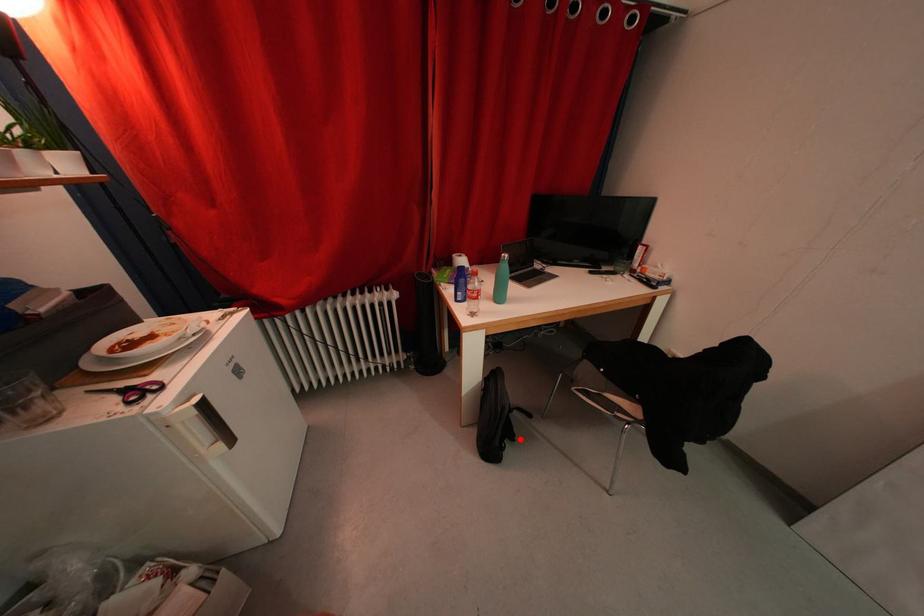
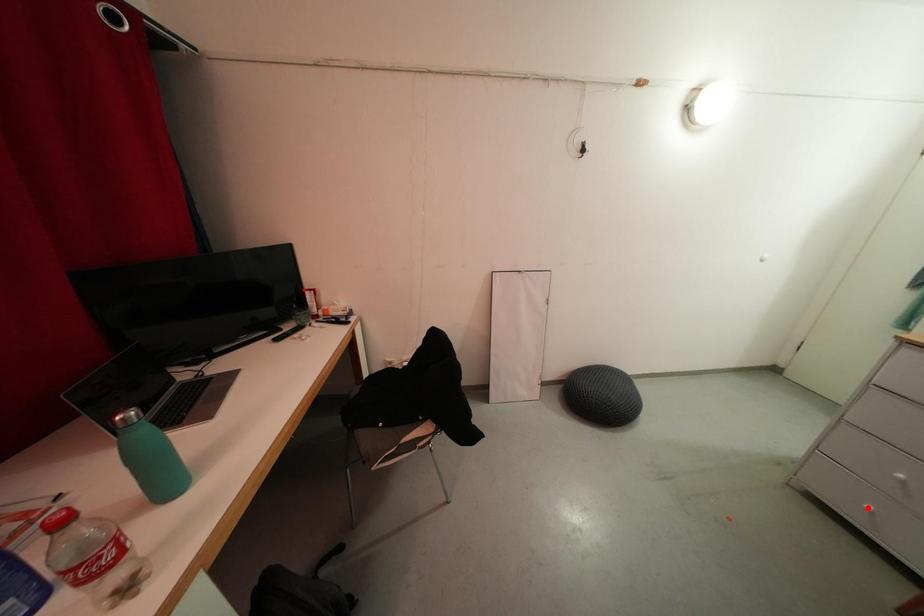
I am providing you with two images of the same scene from different viewpoints. A red point is marked on the first image and another point is marked on the second image. Is the red point in image1 aligned with the point shown in image2?

No